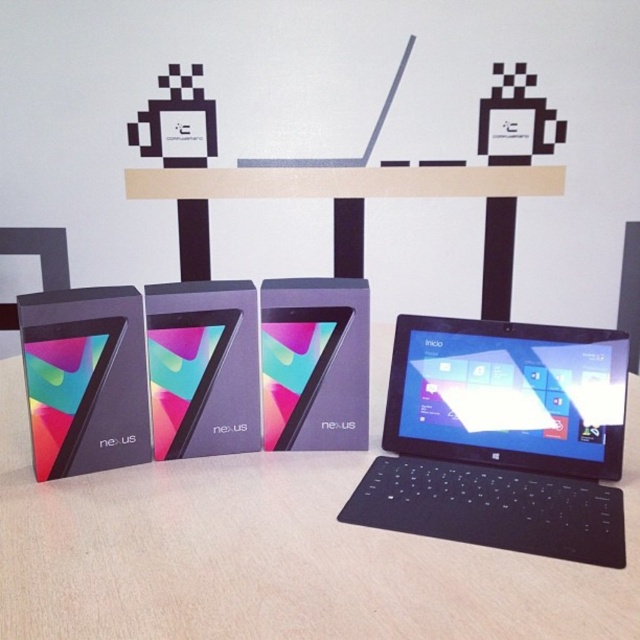
Question: Can you confirm if black matte tablet at center is bigger than matte black tablet at center?

Choices:
 (A) yes
 (B) no

Answer: (A)

Question: Among these points, which one is nearest to the camera?

Choices:
 (A) (285, 314)
 (B) (368, 182)
 (C) (605, 595)

Answer: (C)

Question: Is matte black table at center positioned in front of black plastic table at center?

Choices:
 (A) no
 (B) yes

Answer: (B)

Question: Can you confirm if black matte tablet at center is positioned above matte black tablet at center?

Choices:
 (A) no
 (B) yes

Answer: (A)

Question: Based on their relative distances, which object is farther from the black plastic table at center?

Choices:
 (A) matte black tablet at center
 (B) black matte tablet at center
 (C) matte black table at center

Answer: (B)

Question: Estimate the real-world distances between objects in this image. Which object is closer to the black plastic table at center?

Choices:
 (A) matte black tablet at center
 (B) matte black table at center
 (C) black matte tablet at center

Answer: (A)